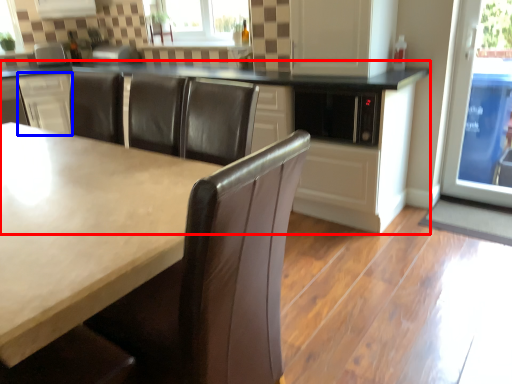
Question: Which object appears closest to the camera in this image, cabinetry (highlighted by a red box) or cabinetry (highlighted by a blue box)?

Choices:
 (A) cabinetry
 (B) cabinetry

Answer: (A)